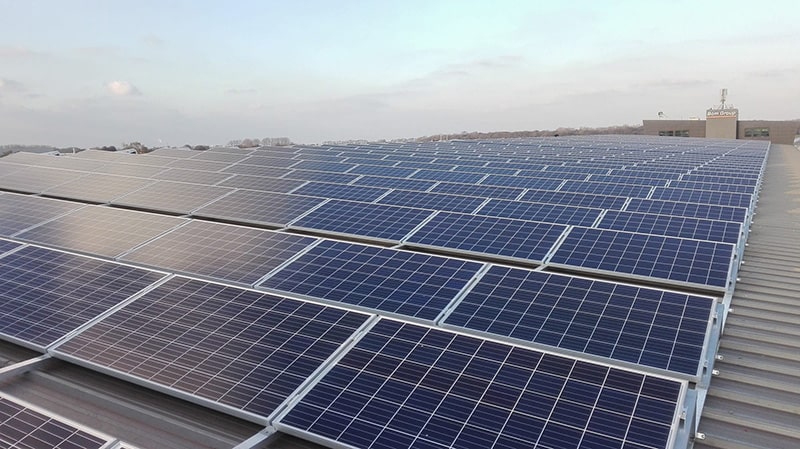
Locate an element on the screen. window is located at coordinates (758, 135), (682, 135).